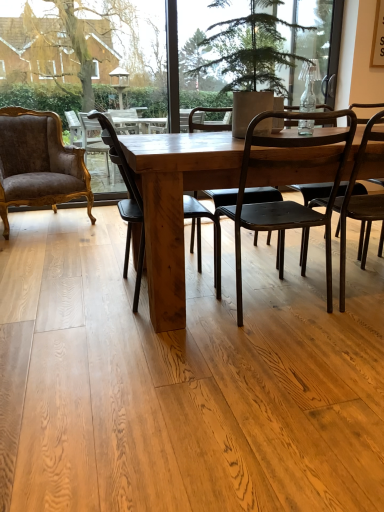
Question: From a real-world perspective, is wooden chair at center, which appears as the 2th chair when viewed from the left, located higher than matte black chair at center, which appears as the second chair when viewed from the right?

Choices:
 (A) yes
 (B) no

Answer: (B)

Question: Could you tell me if wooden chair at center, which appears as the 2th chair when viewed from the left, is facing matte black chair at center, which appears as the second chair when viewed from the right?

Choices:
 (A) no
 (B) yes

Answer: (B)

Question: Does wooden chair at center, which appears as the 2th chair when viewed from the left, have a lesser height compared to matte black chair at center, which appears as the second chair when viewed from the right?

Choices:
 (A) yes
 (B) no

Answer: (B)

Question: Is wooden chair at center, which appears as the 2th chair when viewed from the left, to the right of matte black chair at center, which appears as the second chair when viewed from the right, from the viewer's perspective?

Choices:
 (A) yes
 (B) no

Answer: (B)

Question: Can you confirm if wooden chair at center, positioned as the third chair in right-to-left order, is taller than matte black chair at center, which appears as the second chair when viewed from the right?

Choices:
 (A) no
 (B) yes

Answer: (B)

Question: Considering the positions of matte black chair at right, which ranks as the 1th chair in right-to-left order, and matte black chair at center, which appears as the second chair when viewed from the right, in the image, is matte black chair at right, which ranks as the 1th chair in right-to-left order, wider or thinner than matte black chair at center, which appears as the second chair when viewed from the right,?

Choices:
 (A) thin
 (B) wide

Answer: (A)

Question: From the image's perspective, is matte black chair at right, which ranks as the 1th chair in right-to-left order, located above or below matte black chair at center, acting as the 3th chair starting from the left?

Choices:
 (A) above
 (B) below

Answer: (A)

Question: Considering the positions of matte black chair at right, which ranks as the 1th chair in right-to-left order, and matte black chair at center, which appears as the second chair when viewed from the right, in the image, is matte black chair at right, which ranks as the 1th chair in right-to-left order, bigger or smaller than matte black chair at center, which appears as the second chair when viewed from the right,?

Choices:
 (A) small
 (B) big

Answer: (A)

Question: From a real-world perspective, is matte black chair at right, which ranks as the 1th chair in right-to-left order, above or below matte black chair at center, which appears as the second chair when viewed from the right?

Choices:
 (A) below
 (B) above

Answer: (B)

Question: From the image's perspective, is green textured plant at center located above or below wooden chair at center, positioned as the third chair in right-to-left order?

Choices:
 (A) below
 (B) above

Answer: (B)

Question: Based on their sizes in the image, would you say green textured plant at center is bigger or smaller than wooden chair at center, which appears as the 2th chair when viewed from the left?

Choices:
 (A) big
 (B) small

Answer: (A)

Question: Is green textured plant at center taller or shorter than wooden chair at center, which appears as the 2th chair when viewed from the left?

Choices:
 (A) short
 (B) tall

Answer: (A)

Question: Which is correct: green textured plant at center is inside wooden chair at center, positioned as the third chair in right-to-left order, or outside of it?

Choices:
 (A) inside
 (B) outside

Answer: (B)

Question: Based on their positions, is velvet brown armchair at left, which is the fourth chair in right-to-left order, located to the left or right of matte black chair at right, which ranks as the 1th chair in right-to-left order?

Choices:
 (A) left
 (B) right

Answer: (A)

Question: Choose the correct answer: Is velvet brown armchair at left, acting as the 1th chair starting from the left, inside matte black chair at right, positioned as the 4th chair in left-to-right order, or outside it?

Choices:
 (A) outside
 (B) inside

Answer: (A)